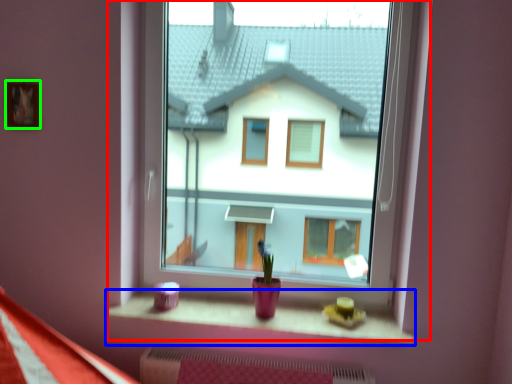
Question: Which is farther away from window (highlighted by a red box)? window sill (highlighted by a blue box) or picture frame (highlighted by a green box)?

Choices:
 (A) window sill
 (B) picture frame

Answer: (B)